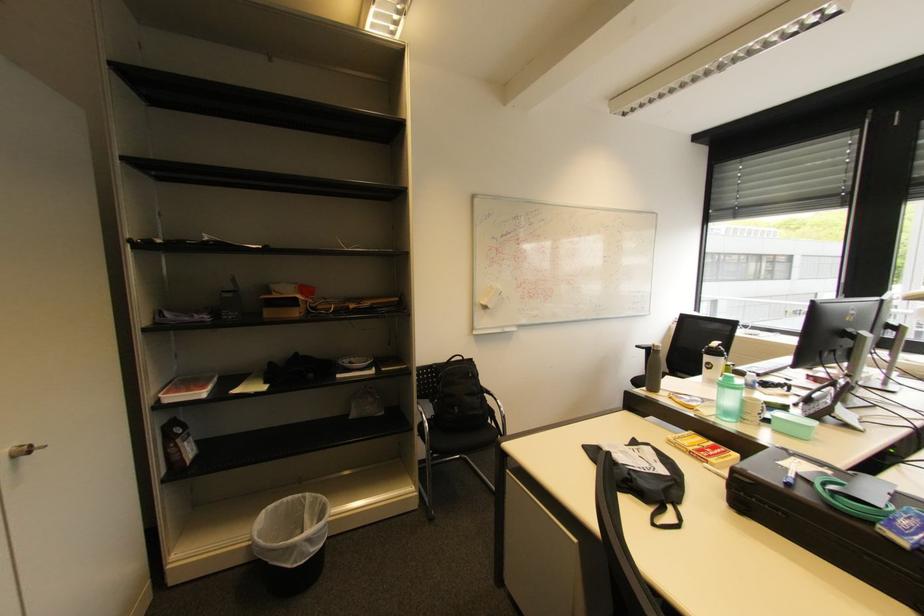
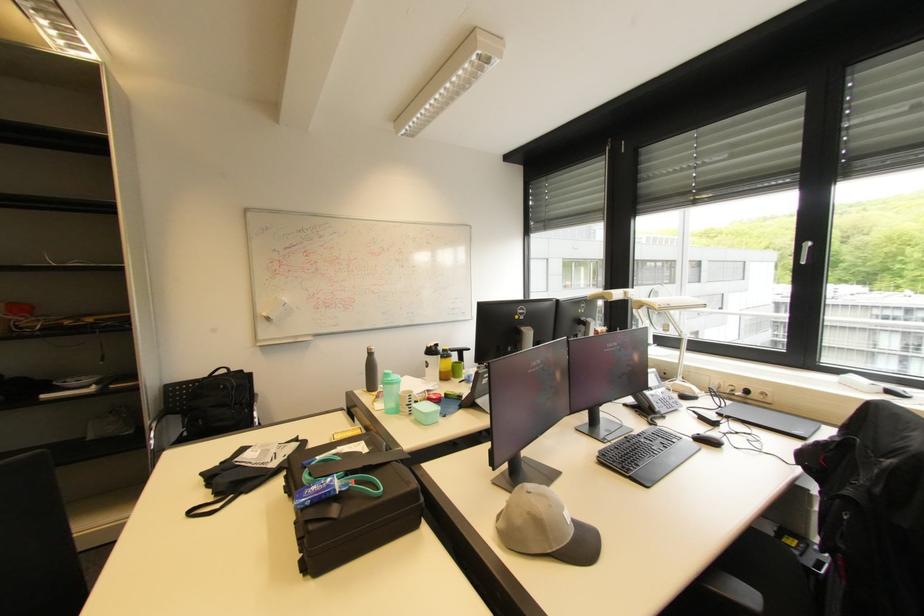
In the second image, find the point that corresponds to pixel 490 309 in the first image.

(273, 320)